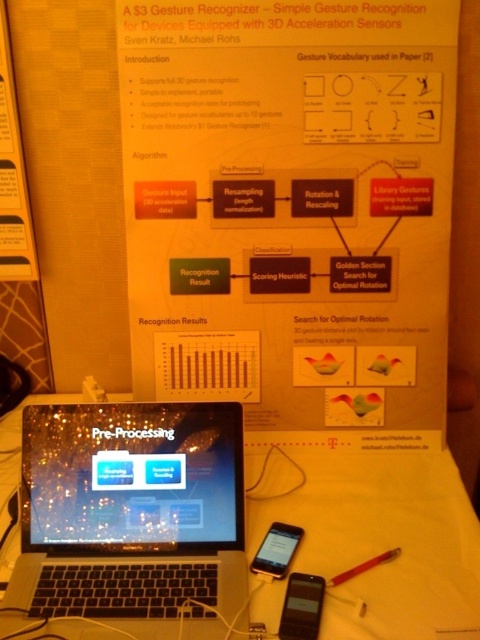
Question: From the image, what is the correct spatial relationship of white paper at upper center in relation to matte black smartphone at lower center?

Choices:
 (A) right
 (B) left

Answer: (A)

Question: In this image, where is white paper at upper center located relative to matte black smartphone at lower center?

Choices:
 (A) above
 (B) below

Answer: (A)

Question: Which object is positioned closest to the satin black laptop at center?

Choices:
 (A) black matte smartphone at lower right
 (B) matte black smartphone at lower center

Answer: (B)

Question: Which object is closer to the camera taking this photo?

Choices:
 (A) white paper at upper center
 (B) black matte smartphone at lower right

Answer: (B)

Question: Based on their relative distances, which object is nearer to the satin black laptop at center?

Choices:
 (A) matte black smartphone at lower center
 (B) black matte smartphone at lower right
 (C) white paper at upper center

Answer: (A)

Question: Can you confirm if black matte smartphone at lower right is wider than matte black smartphone at lower center?

Choices:
 (A) no
 (B) yes

Answer: (A)